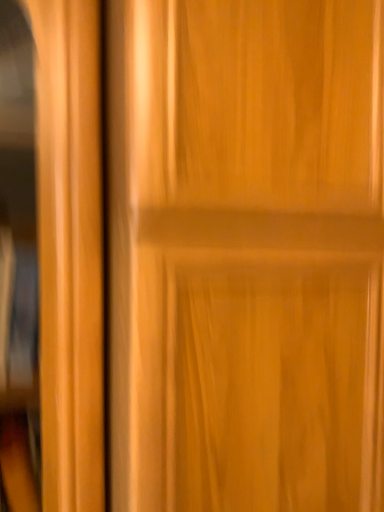
Question: Should I look upward or downward to see wooden door at center?

Choices:
 (A) down
 (B) up

Answer: (A)